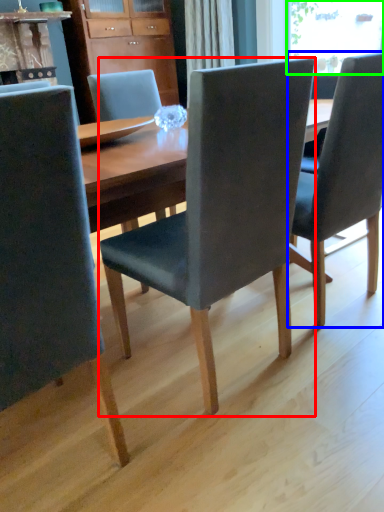
Question: Considering the real-world distances, which object is closest to chair (highlighted by a red box)? chair (highlighted by a blue box) or window screen (highlighted by a green box).

Choices:
 (A) chair
 (B) window screen

Answer: (A)